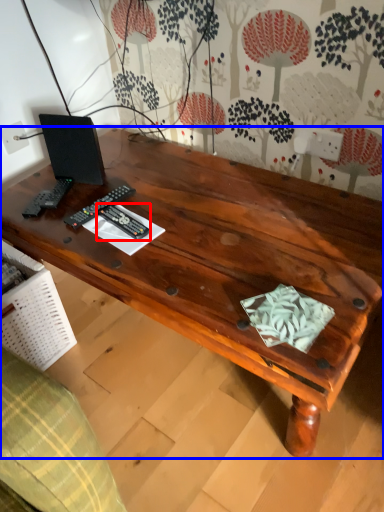
Question: Among these objects, which one is nearest to the camera, control (highlighted by a red box) or desk (highlighted by a blue box)?

Choices:
 (A) control
 (B) desk

Answer: (B)